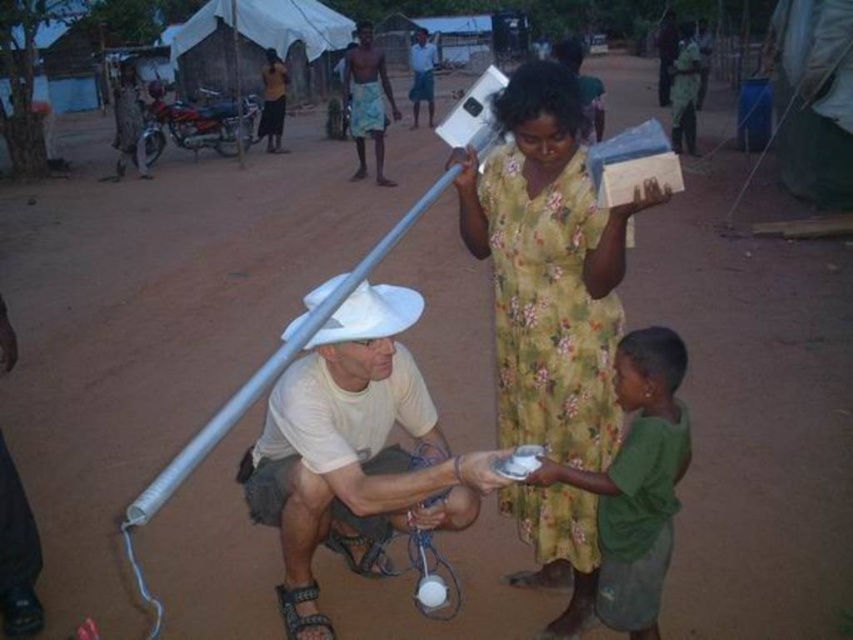
Is point (671, 419) farther from viewer compared to point (375, 148)?

No, (671, 419) is closer to viewer.

Where is `green cotton shirt at lower right`? This screenshot has height=640, width=853. green cotton shirt at lower right is located at coordinates (637, 481).

Based on the photo, can you confirm if light brown woven cloth at center is positioned to the left of black fabric sandal at lower center?

Correct, you'll find light brown woven cloth at center to the left of black fabric sandal at lower center.

Who is more forward, (380, 172) or (294, 632)?

Positioned in front is point (294, 632).

Describe the element at coordinates (367, 100) in the screenshot. I see `light brown woven cloth at center` at that location.

Find the location of a particular element. Image resolution: width=853 pixels, height=640 pixels. light brown woven cloth at center is located at coordinates (367, 100).

Measure the distance between floral cotton dress at center and black fabric sandal at lower center.

floral cotton dress at center is 1.01 meters from black fabric sandal at lower center.

Is point (581, 273) positioned behind point (289, 589)?

No, (581, 273) is closer to viewer.

The width and height of the screenshot is (853, 640). I want to click on floral cotton dress at center, so click(549, 312).